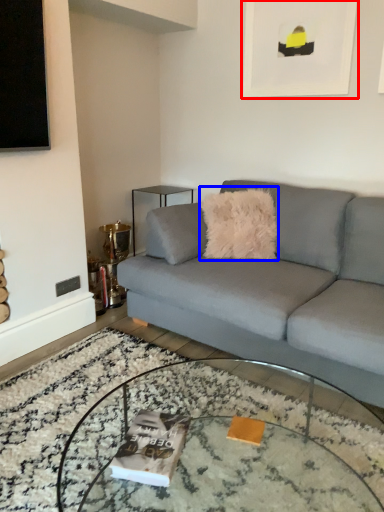
Question: Which of the following is the farthest to the observer, picture frame (highlighted by a red box) or throw pillow (highlighted by a blue box)?

Choices:
 (A) picture frame
 (B) throw pillow

Answer: (B)